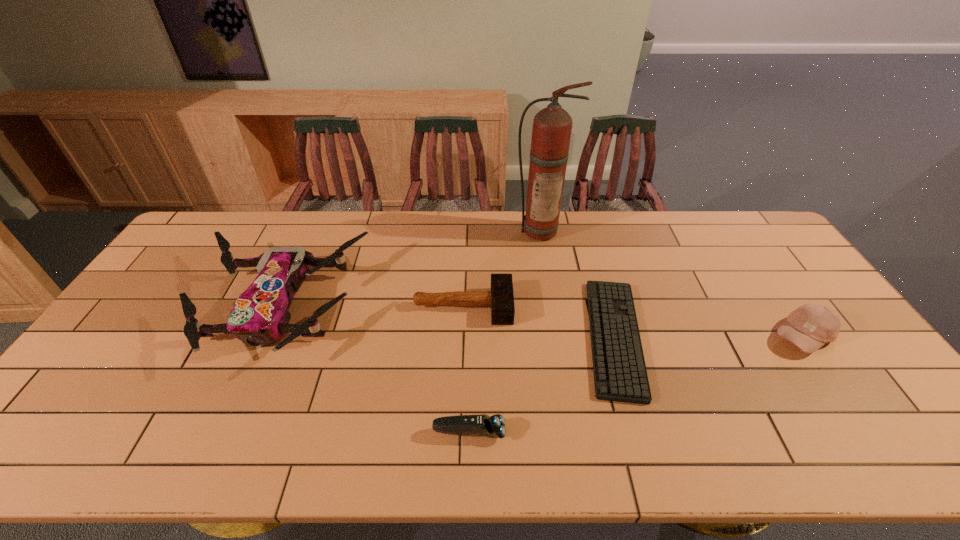
The width and height of the screenshot is (960, 540). What are the coordinates of `free space located 0.150m on the front-facing side of the drone` in the screenshot? It's located at (223, 429).

Find the location of a particular element. This screenshot has width=960, height=540. vacant space located on the front-facing side of the fourth shortest object is located at coordinates (831, 378).

Image resolution: width=960 pixels, height=540 pixels. Identify the location of blank space located on the hammer head face of the mallet. (613, 306).

Identify the location of vacant region located on the head of the nearest object. The image size is (960, 540). (622, 432).

Identify the location of vacant point located on the back of the computer keyboard. This screenshot has width=960, height=540. [x=582, y=224].

This screenshot has width=960, height=540. I want to click on object located at the far edge, so click(552, 126).

At what (x,y) coordinates should I click in order to perform the action: click on object that is at the near edge. Please return your answer as a coordinate pair (x, y). This screenshot has height=540, width=960. Looking at the image, I should click on (492, 426).

At what (x,y) coordinates should I click in order to perform the action: click on object that is at the right edge. Please return your answer as a coordinate pair (x, y). The width and height of the screenshot is (960, 540). Looking at the image, I should click on (809, 327).

In the image, there is a desktop. At what (x,y) coordinates should I click in order to perform the action: click on vacant region at the far edge. Please return your answer as a coordinate pair (x, y). Image resolution: width=960 pixels, height=540 pixels. Looking at the image, I should click on (699, 243).

Locate an element on the screen. This screenshot has width=960, height=540. free space at the near edge is located at coordinates (404, 431).